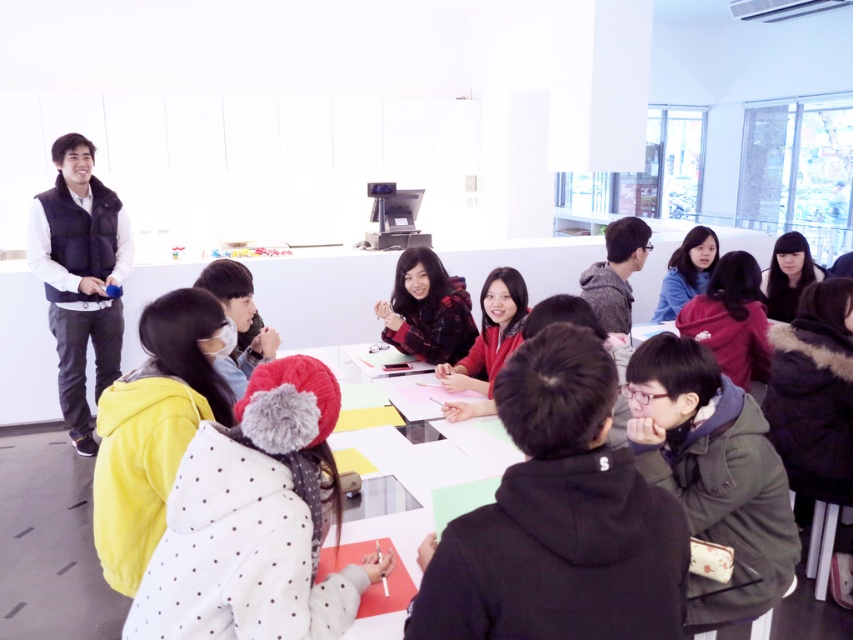
You are sitting at the table and want to borrow a jacket from either the yellow fleece jacket at lower left or the blue fabric jacket at upper right. Which jacket is closer to your current position?

The yellow fleece jacket at lower left is closer to your current position because it is to the left of the blue fabric jacket at upper right, placing it nearer to the table where you are sitting.

You are a person sitting at the table in the image. You want to throw a small object to the matte black hoodie at center. What are the coordinates you should aim for?

You should aim for the coordinates point (560, 518) as that is where the matte black hoodie at center is located.

You are a participant in the meeting and need to retrieve your yellow fleece jacket at lower left. The blue fabric jacket at upper right is blocking your path. Can you move around it to reach your jacket?

The yellow fleece jacket at lower left is in front of the blue fabric jacket at upper right, so you can move around the blue fabric jacket at upper right to reach the yellow fleece jacket at lower left.